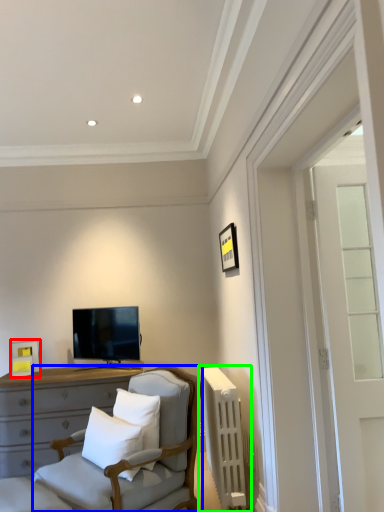
Question: Based on their relative distances, which object is nearer to picture frame (highlighted by a red box)? Choose from chair (highlighted by a blue box) and radiator (highlighted by a green box).

Choices:
 (A) chair
 (B) radiator

Answer: (A)